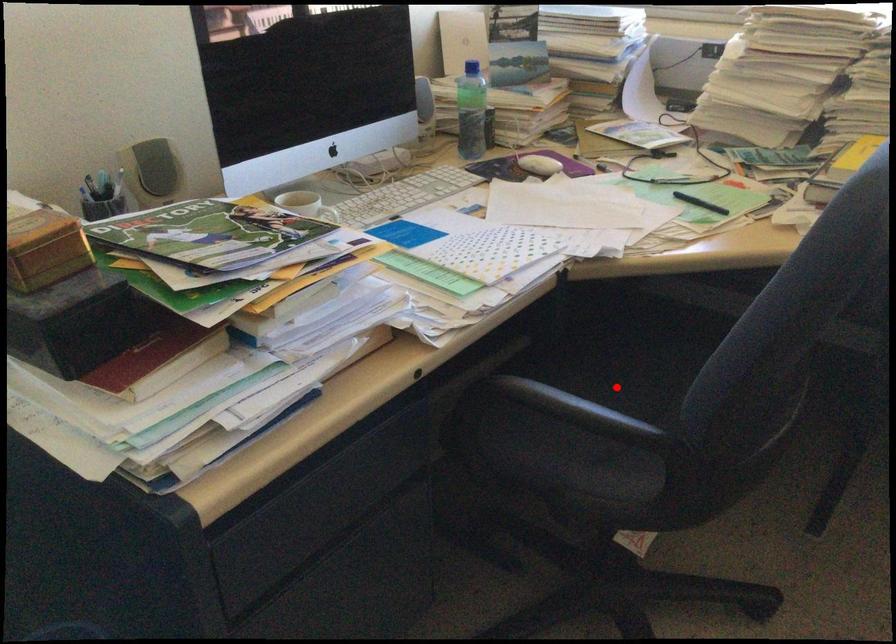
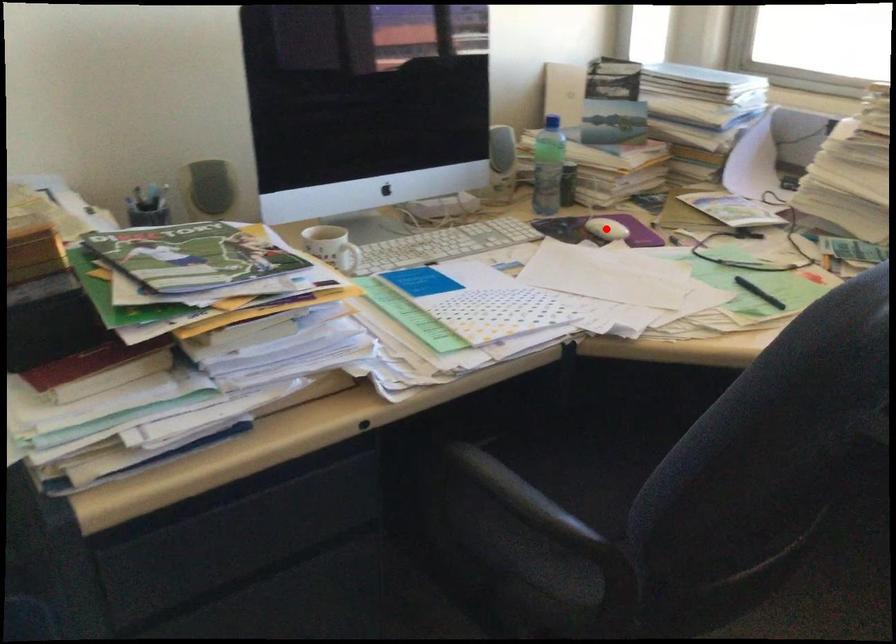
I am providing you with two images of the same scene from different viewpoints. A red point is marked on the first image and another point is marked on the second image. Is the marked point in image1 the same physical position as the marked point in image2?

No